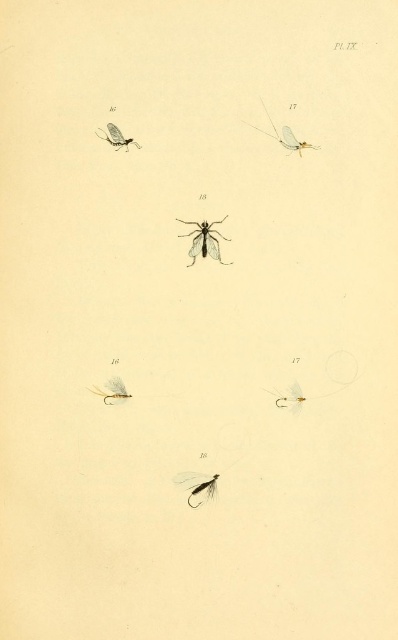
Does matte black fly at center have a lesser height compared to translucent white insect at upper center?

Indeed, matte black fly at center has a lesser height compared to translucent white insect at upper center.

Does matte black fly at center have a greater height compared to translucent white insect at upper center?

Incorrect, matte black fly at center's height is not larger of translucent white insect at upper center's.

Find the location of `matte black fly at center`. matte black fly at center is located at coordinates (197, 486).

Between point (230, 262) and point (296, 147), which one is positioned in front?

Positioned in front is point (296, 147).

Can you confirm if transparent plastic mosquito at center is positioned to the left of translucent white insect at upper center?

Yes, transparent plastic mosquito at center is to the left of translucent white insect at upper center.

You are a GUI agent. You are given a task and a screenshot of the screen. Output one action in this format:
    pyautogui.click(x=<x>, y=<y>)
    Task: Click on the transparent plastic mosquito at center
    
    Given the screenshot: What is the action you would take?
    pyautogui.click(x=204, y=240)

Who is positioned more to the left, transparent plastic mosquito at center or matte gold hook at lower right?

Positioned to the left is transparent plastic mosquito at center.

Is point (204, 225) positioned before point (286, 397)?

Yes, point (204, 225) is closer to viewer.

Between point (206, 241) and point (288, 394), which one is positioned behind?

The point (288, 394) is more distant.

This screenshot has width=398, height=640. I want to click on transparent plastic mosquito at center, so click(204, 240).